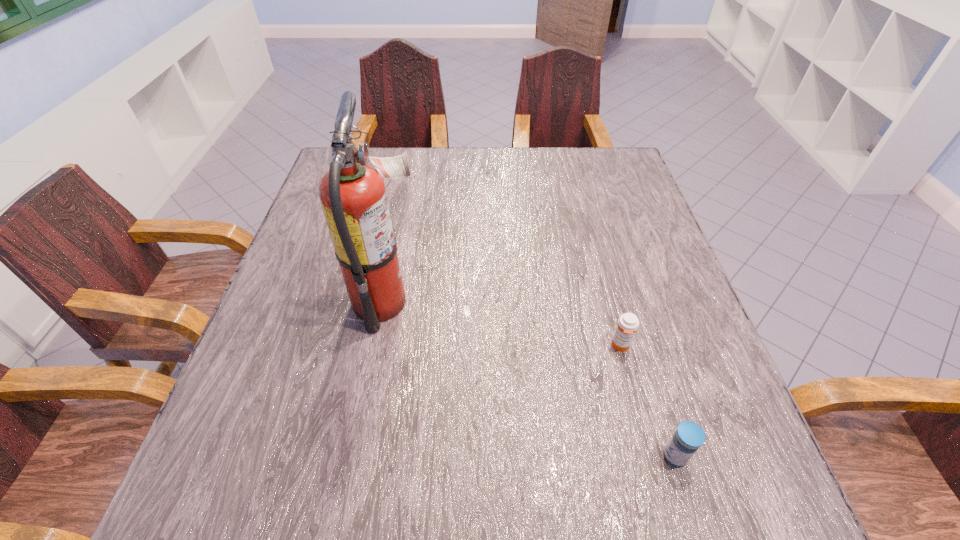
Find the location of a particular element. vacant space that satisfies the following two spatial constraints: 1. from the nozzle of the tallest object; 2. on the left side of the nearer medicine is located at coordinates (359, 456).

At what (x,y) coordinates should I click in order to perform the action: click on free region that satisfies the following two spatial constraints: 1. on the front side of the farther medicine; 2. on the right side of the nearest object. Please return your answer as a coordinate pair (x, y). The width and height of the screenshot is (960, 540). Looking at the image, I should click on (650, 456).

This screenshot has width=960, height=540. What are the coordinates of `vacant space that satisfies the following two spatial constraints: 1. from the nozzle of the fire extinguisher; 2. on the right side of the second object from right to left` in the screenshot? It's located at (379, 346).

The width and height of the screenshot is (960, 540). What are the coordinates of `free location that satisfies the following two spatial constraints: 1. from the nozzle of the nearest object; 2. on the right side of the tallest object` in the screenshot? It's located at (359, 456).

Where is `vacant space that satisfies the following two spatial constraints: 1. on the back side of the second object from right to left; 2. from the nozzle of the tallest object`? The width and height of the screenshot is (960, 540). vacant space that satisfies the following two spatial constraints: 1. on the back side of the second object from right to left; 2. from the nozzle of the tallest object is located at coordinates (610, 302).

Where is `vacant space that satisfies the following two spatial constraints: 1. from the nozzle of the tallest object; 2. on the left side of the left medicine`? This screenshot has width=960, height=540. vacant space that satisfies the following two spatial constraints: 1. from the nozzle of the tallest object; 2. on the left side of the left medicine is located at coordinates [379, 346].

Image resolution: width=960 pixels, height=540 pixels. What are the coordinates of `free spot that satisfies the following two spatial constraints: 1. from the nozzle of the rightmost object; 2. on the right side of the leftmost object` in the screenshot? It's located at (359, 456).

This screenshot has height=540, width=960. I want to click on free space in the image that satisfies the following two spatial constraints: 1. on the front side of the rightmost object; 2. on the left side of the farther medicine, so click(x=650, y=456).

You are a GUI agent. You are given a task and a screenshot of the screen. Output one action in this format:
    pyautogui.click(x=<x>, y=<y>)
    Task: Click on the vacant space that satisfies the following two spatial constraints: 1. from the nozzle of the leftmost object; 2. on the right side of the second object from left to right
    
    Given the screenshot: What is the action you would take?
    pyautogui.click(x=379, y=346)

Locate an element on the screen. The image size is (960, 540). free space that satisfies the following two spatial constraints: 1. on the front side of the nearest object; 2. on the left side of the second object from left to right is located at coordinates (650, 456).